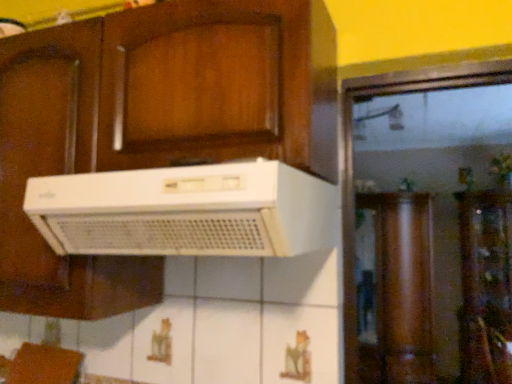
Question: Could white plastic range hood at center be considered to be inside transparent glass cabinet at center?

Choices:
 (A) yes
 (B) no

Answer: (B)

Question: Is transparent glass cabinet at center turned away from white plastic range hood at center?

Choices:
 (A) no
 (B) yes

Answer: (A)

Question: Is transparent glass cabinet at center far from white plastic range hood at center?

Choices:
 (A) no
 (B) yes

Answer: (B)

Question: From the image's perspective, is transparent glass cabinet at center over white plastic range hood at center?

Choices:
 (A) yes
 (B) no

Answer: (B)

Question: Is transparent glass cabinet at center beside white plastic range hood at center?

Choices:
 (A) yes
 (B) no

Answer: (B)

Question: Does transparent glass cabinet at center appear on the left side of white plastic range hood at center?

Choices:
 (A) no
 (B) yes

Answer: (A)

Question: Does white plastic range hood at center have a lesser height compared to transparent glass cabinet at center?

Choices:
 (A) yes
 (B) no

Answer: (A)

Question: Is white plastic range hood at center with transparent glass cabinet at center?

Choices:
 (A) yes
 (B) no

Answer: (B)

Question: Could you tell me if white plastic range hood at center is facing transparent glass cabinet at center?

Choices:
 (A) no
 (B) yes

Answer: (A)

Question: Is white plastic range hood at center positioned beyond the bounds of transparent glass cabinet at center?

Choices:
 (A) no
 (B) yes

Answer: (B)

Question: Does white plastic range hood at center have a larger size compared to transparent glass cabinet at center?

Choices:
 (A) yes
 (B) no

Answer: (B)

Question: From a real-world perspective, is white plastic range hood at center physically below transparent glass cabinet at center?

Choices:
 (A) no
 (B) yes

Answer: (A)

Question: Is transparent glass cabinet at center wider or thinner than white plastic range hood at center?

Choices:
 (A) wide
 (B) thin

Answer: (A)